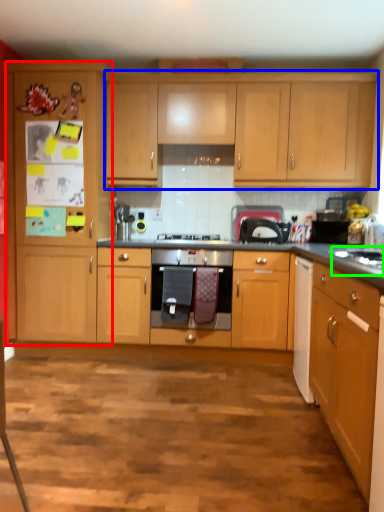
Question: Based on their relative distances, which object is nearer to cabinetry (highlighted by a red box)? Choose from cabinetry (highlighted by a blue box) and sink (highlighted by a green box).

Choices:
 (A) cabinetry
 (B) sink

Answer: (A)